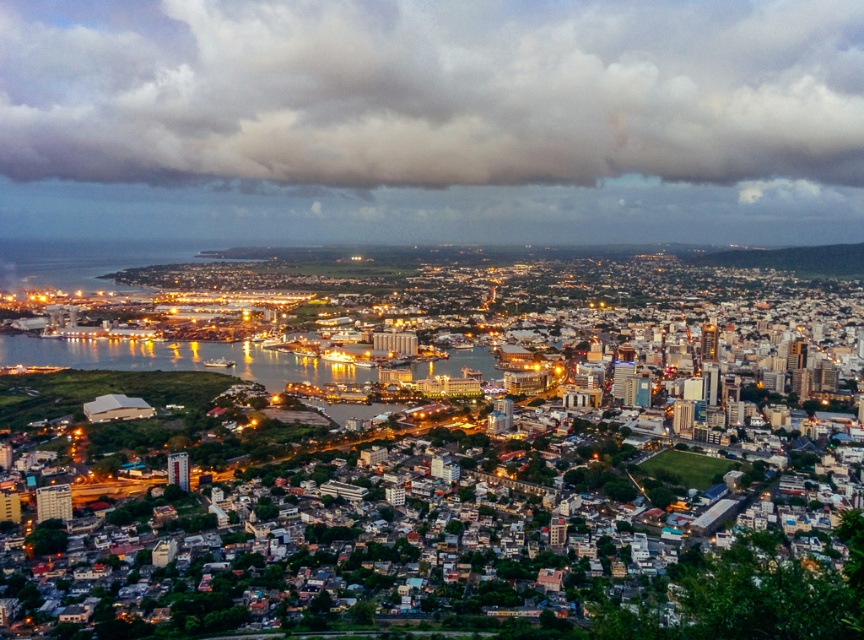
Question: Which of the following is the closest to the observer?

Choices:
 (A) gray cotton cloud at upper center
 (B) matte urban landscape at lower left

Answer: (B)

Question: Can you confirm if matte urban landscape at lower left is wider than gray cotton cloud at upper center?

Choices:
 (A) yes
 (B) no

Answer: (A)

Question: Which of the following is the farthest from the observer?

Choices:
 (A) matte urban landscape at lower left
 (B) gray cotton cloud at upper center

Answer: (B)

Question: Where is matte urban landscape at lower left located in relation to gray cotton cloud at upper center in the image?

Choices:
 (A) left
 (B) right

Answer: (B)

Question: Can you confirm if matte urban landscape at lower left is positioned to the left of gray cotton cloud at upper center?

Choices:
 (A) yes
 (B) no

Answer: (B)